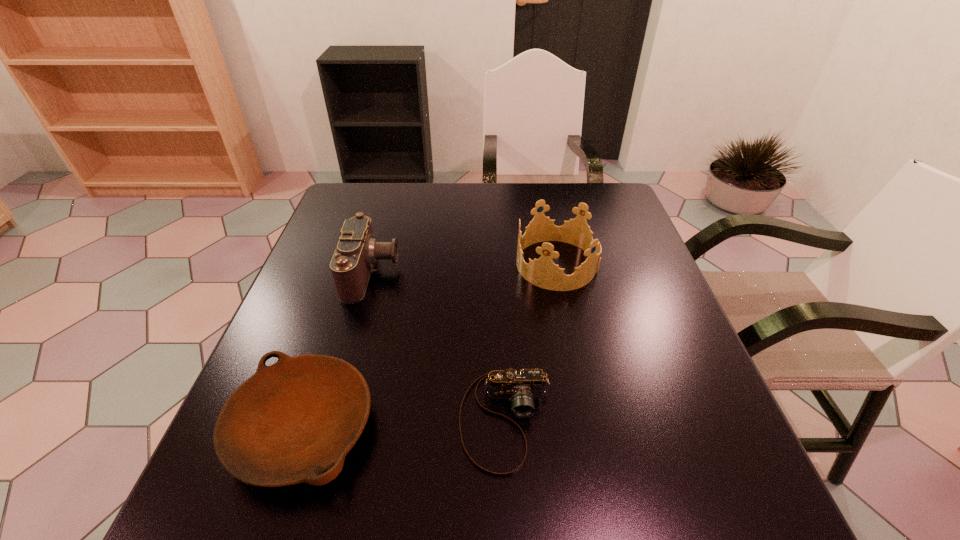
I want to click on tiara, so [543, 272].

You are a GUI agent. You are given a task and a screenshot of the screen. Output one action in this format:
    pyautogui.click(x=<x>, y=<y>)
    Task: Click on the farther camera
    The image size is (960, 540).
    Given the screenshot: What is the action you would take?
    pyautogui.click(x=357, y=251)

Locate an element on the screen. The width and height of the screenshot is (960, 540). the taller camera is located at coordinates (357, 251).

This screenshot has width=960, height=540. Find the location of `plate`. plate is located at coordinates (290, 422).

Identify the location of the shorter camera. Image resolution: width=960 pixels, height=540 pixels. coord(521,387).

This screenshot has height=540, width=960. Find the location of `the nearer camera`. the nearer camera is located at coordinates (521, 387).

This screenshot has height=540, width=960. What are the coordinates of `vacant space located on the front-facing side of the tiara` in the screenshot? It's located at (454, 264).

Locate an element on the screen. The height and width of the screenshot is (540, 960). vacant space located 0.220m on the front-facing side of the tiara is located at coordinates (430, 264).

I want to click on free space located on the front-facing side of the tiara, so click(x=392, y=264).

Where is `free point located on the front-facing side of the farther camera`? This screenshot has height=540, width=960. free point located on the front-facing side of the farther camera is located at coordinates (546, 273).